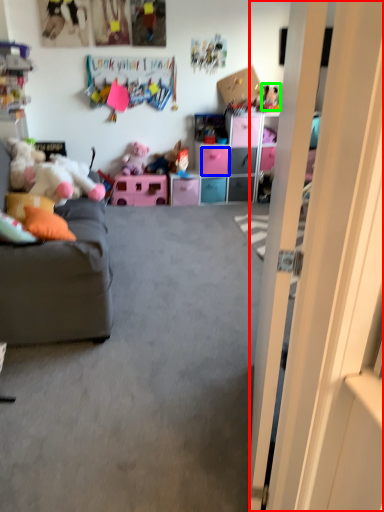
Question: Which object is positioned farthest from door (highlighted by a red box)? Select from drawer (highlighted by a blue box) and toy (highlighted by a green box).

Choices:
 (A) drawer
 (B) toy

Answer: (B)